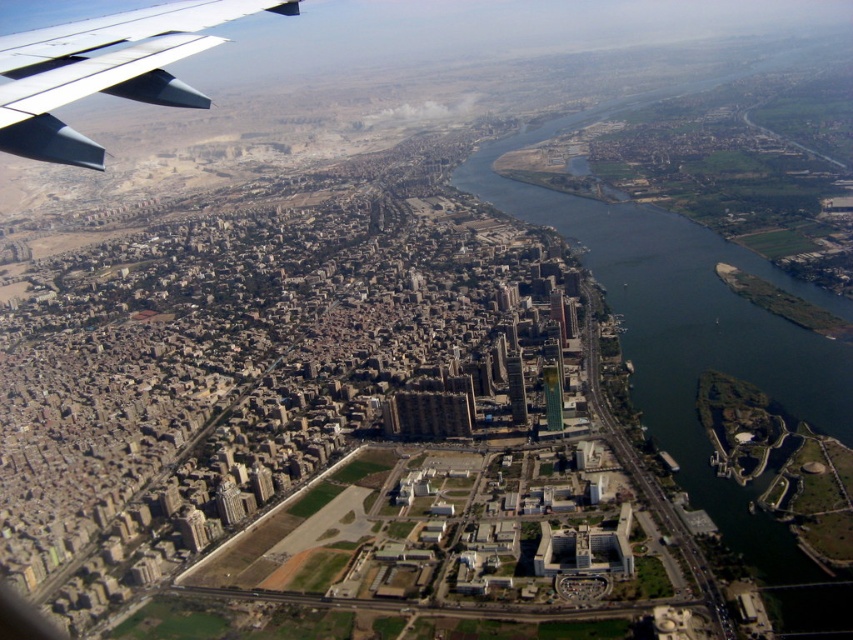
Who is positioned more to the right, green water at center right or metallic gray wing at upper left?

Positioned to the right is green water at center right.

Is green water at center right below metallic gray wing at upper left?

Correct, green water at center right is located below metallic gray wing at upper left.

Which is in front, point (672, 262) or point (77, 97)?

Point (77, 97) is more forward.

I want to click on green water at center right, so click(689, 324).